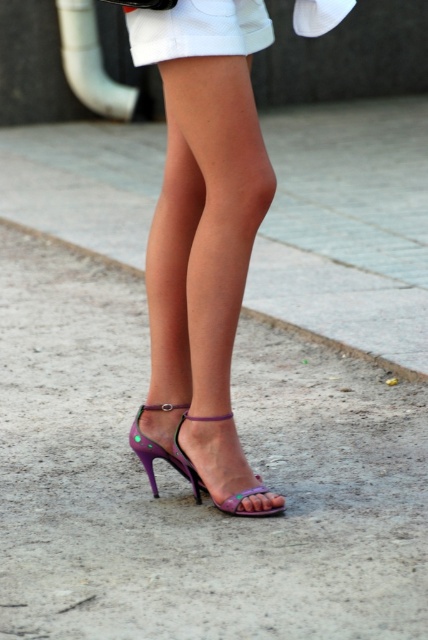
You are a fashion designer observing the image. You need to determine the order of the items from top to bottom. Which item is positioned higher on the body between the white cotton shorts at center and the purple shiny sandal at lower center?

The white cotton shorts at center is located above the purple shiny sandal at lower center, so the white cotton shorts at center is positioned higher on the body.

You are a photographer adjusting your camera focus. You need to focus on two points in the image, point 1 at point (154, 483) and point 2 at point (196, 499). Which point should you focus on first if you want to capture the closest object to the camera?

Point 1 at point (154, 483) should be focused on first because it is closer to the camera than point 2 at point (196, 499).

You are a photographer adjusting your camera focus. You notice the white cotton shorts at center and the purple shiny sandal at lower center in your frame. Which object should you focus on first to ensure it appears sharp in the photo?

The white cotton shorts at center is closer to the viewer than the purple shiny sandal at lower center, so you should focus on the white cotton shorts at center first to ensure it appears sharp.